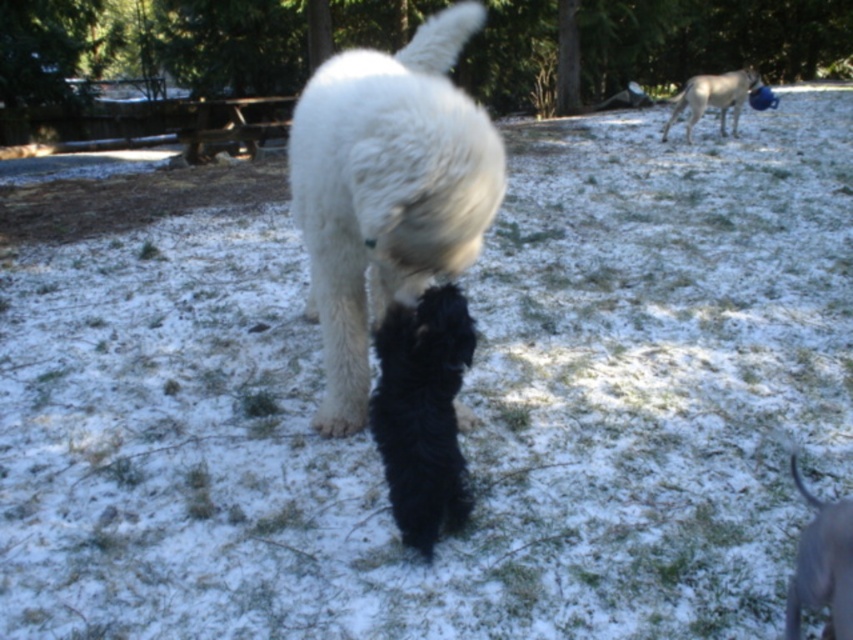
Question: Is black fluffy tail at center to the left of white fur dog at upper right from the viewer's perspective?

Choices:
 (A) no
 (B) yes

Answer: (B)

Question: Does white fluffy dog at center have a greater width compared to white fur dog at upper right?

Choices:
 (A) no
 (B) yes

Answer: (A)

Question: Is the position of white fluffy dog at center less distant than that of white fur dog at upper right?

Choices:
 (A) no
 (B) yes

Answer: (B)

Question: Which point appears farthest from the camera in this image?

Choices:
 (A) (843, 561)
 (B) (692, 93)

Answer: (B)

Question: Among these objects, which one is nearest to the camera?

Choices:
 (A) white fur dog at upper right
 (B) black fluffy tail at center

Answer: (B)

Question: Which point appears closest to the camera in this image?

Choices:
 (A) (432, 248)
 (B) (456, 524)
 (C) (721, 125)
 (D) (822, 516)

Answer: (D)